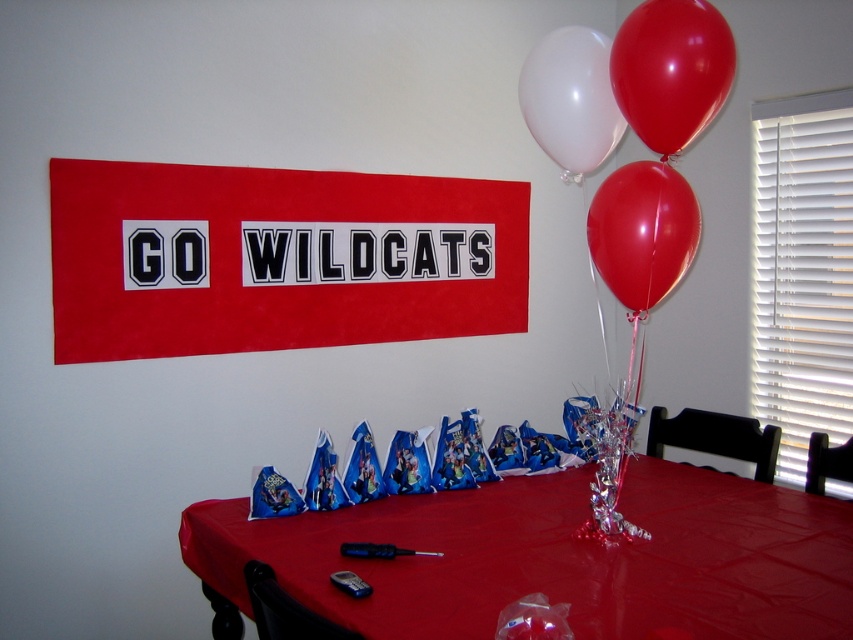
Does red fabric banner at upper center have a lesser height compared to rubber balloon at upper right?

Incorrect, red fabric banner at upper center's height does not fall short of rubber balloon at upper right's.

Which is below, red fabric banner at upper center or rubber balloon at upper right?

Positioned lower is red fabric banner at upper center.

I want to click on red fabric banner at upper center, so click(277, 259).

Which is behind, point (634, 102) or point (605, 150)?

The point (605, 150) is behind.

Which of these two, rubber balloon at upper right or white glossy balloon at upper center, stands shorter?

Standing shorter between the two is rubber balloon at upper right.

Is point (712, 49) in front of point (608, 104)?

Yes, point (712, 49) is closer to viewer.

Where is `rubber balloon at upper right`? The width and height of the screenshot is (853, 640). rubber balloon at upper right is located at coordinates (671, 70).

Can you confirm if red plastic table at center is smaller than white glossy balloon at upper center?

No, red plastic table at center is not smaller than white glossy balloon at upper center.

Is red plastic table at center taller than white glossy balloon at upper center?

In fact, red plastic table at center may be shorter than white glossy balloon at upper center.

The width and height of the screenshot is (853, 640). I want to click on red plastic table at center, so click(x=556, y=557).